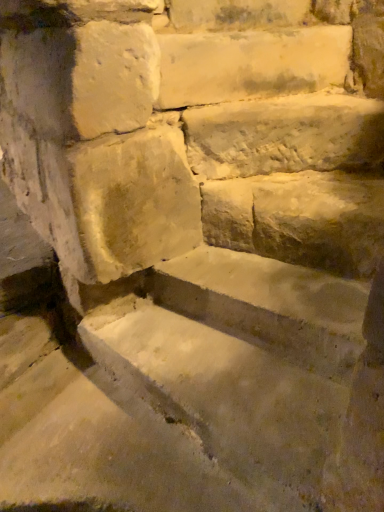
In order to face white stone step at upper center, which ranks as the first limestone in top-to-bottom order, should I rotate leftwards or rightwards?

To align with it, rotate right about 6.845°.

Describe the element at coordinates (237, 14) in the screenshot. I see `smooth stone brick at upper center` at that location.

Where is `white rough stone at center, which is the 2th limestone in top-to-bottom order`? white rough stone at center, which is the 2th limestone in top-to-bottom order is located at coordinates (285, 135).

Based on their sizes in the image, would you say white rough stone at center, acting as the 1th limestone starting from the bottom, is bigger or smaller than white stone step at upper center, the 2th limestone positioned from the bottom?

In the image, white rough stone at center, acting as the 1th limestone starting from the bottom, appears to be larger than white stone step at upper center, the 2th limestone positioned from the bottom.

Does white rough stone at center, which is the 2th limestone in top-to-bottom order, have a lesser height compared to white stone step at upper center, which ranks as the first limestone in top-to-bottom order?

Correct, white rough stone at center, which is the 2th limestone in top-to-bottom order, is not as tall as white stone step at upper center, which ranks as the first limestone in top-to-bottom order.

Is there a large distance between white rough stone at center, acting as the 1th limestone starting from the bottom, and white stone step at upper center, which ranks as the first limestone in top-to-bottom order?

No, there isn't a large distance between white rough stone at center, acting as the 1th limestone starting from the bottom, and white stone step at upper center, which ranks as the first limestone in top-to-bottom order.

Is white rough stone at center, acting as the 1th limestone starting from the bottom, to the right of white stone step at upper center, the 2th limestone positioned from the bottom, from the viewer's perspective?

Indeed, white rough stone at center, acting as the 1th limestone starting from the bottom, is positioned on the right side of white stone step at upper center, the 2th limestone positioned from the bottom.

Is smooth stone brick at upper center oriented towards white stone step at upper center, which ranks as the first limestone in top-to-bottom order?

No.

Is white stone step at upper center, the 2th limestone positioned from the bottom, located within smooth stone brick at upper center?

No, white stone step at upper center, the 2th limestone positioned from the bottom, is located outside of smooth stone brick at upper center.

Based on the photo, who is more distant, smooth stone brick at upper center or white stone step at upper center, the 2th limestone positioned from the bottom?

smooth stone brick at upper center is behind.

I want to click on brick behind the white stone step at upper center, which ranks as the first limestone in top-to-bottom order, so click(x=237, y=14).

Is white stone step at upper center, which ranks as the first limestone in top-to-bottom order, with smooth stone brick at upper center?

white stone step at upper center, which ranks as the first limestone in top-to-bottom order, and smooth stone brick at upper center are clearly separated.

The height and width of the screenshot is (512, 384). What are the coordinates of `brick located above the white stone step at upper center, the 2th limestone positioned from the bottom (from a real-world perspective)` in the screenshot? It's located at (237, 14).

Is smooth stone brick at upper center at the back of white stone step at upper center, the 2th limestone positioned from the bottom?

white stone step at upper center, the 2th limestone positioned from the bottom, is not turned away from smooth stone brick at upper center.

Where is `brick on the left side of white rough stone at center, which is the 2th limestone in top-to-bottom order`? brick on the left side of white rough stone at center, which is the 2th limestone in top-to-bottom order is located at coordinates (237, 14).

Based on the photo, how distant is white rough stone at center, acting as the 1th limestone starting from the bottom, from smooth stone brick at upper center?

white rough stone at center, acting as the 1th limestone starting from the bottom, is 16.09 inches from smooth stone brick at upper center.

In terms of width, does white rough stone at center, acting as the 1th limestone starting from the bottom, look wider or thinner when compared to smooth stone brick at upper center?

Considering their sizes, white rough stone at center, acting as the 1th limestone starting from the bottom, looks broader than smooth stone brick at upper center.

Is white rough stone at center, acting as the 1th limestone starting from the bottom, taller or shorter than smooth stone brick at upper center?

Clearly, white rough stone at center, acting as the 1th limestone starting from the bottom, is taller compared to smooth stone brick at upper center.

Is smooth stone brick at upper center in contact with white rough stone at center, which is the 2th limestone in top-to-bottom order?

smooth stone brick at upper center and white rough stone at center, which is the 2th limestone in top-to-bottom order, are not in contact.

This screenshot has height=512, width=384. I want to click on brick lying behind the white rough stone at center, acting as the 1th limestone starting from the bottom, so [237, 14].

Can you confirm if smooth stone brick at upper center is positioned to the right of white rough stone at center, which is the 2th limestone in top-to-bottom order?

No.

Does smooth stone brick at upper center have a greater height compared to white rough stone at center, acting as the 1th limestone starting from the bottom?

In fact, smooth stone brick at upper center may be shorter than white rough stone at center, acting as the 1th limestone starting from the bottom.

Based on the photo, is white stone step at upper center, the 2th limestone positioned from the bottom, surrounding white rough stone at center, acting as the 1th limestone starting from the bottom?

No.

Which object is positioned more to the left, white stone step at upper center, the 2th limestone positioned from the bottom, or white rough stone at center, which is the 2th limestone in top-to-bottom order?

Positioned to the left is white stone step at upper center, the 2th limestone positioned from the bottom.

From a real-world perspective, who is located higher, white stone step at upper center, the 2th limestone positioned from the bottom, or white rough stone at center, acting as the 1th limestone starting from the bottom?

In real-world perspective, white stone step at upper center, the 2th limestone positioned from the bottom, is above.

I want to click on limestone located below the white stone step at upper center, which ranks as the first limestone in top-to-bottom order (from the image's perspective), so click(285, 135).

Where is `limestone that is the 1st object to the right of the smooth stone brick at upper center, starting at the anchor`? This screenshot has width=384, height=512. limestone that is the 1st object to the right of the smooth stone brick at upper center, starting at the anchor is located at coordinates (250, 64).

Estimate the real-world distances between objects in this image. Which object is closer to white rough stone at center, acting as the 1th limestone starting from the bottom, smooth stone brick at upper center or white stone step at upper center, the 2th limestone positioned from the bottom?

white stone step at upper center, the 2th limestone positioned from the bottom, is positioned closer to the anchor white rough stone at center, acting as the 1th limestone starting from the bottom.

Estimate the real-world distances between objects in this image. Which object is further from white rough stone at center, which is the 2th limestone in top-to-bottom order, white stone step at upper center, the 2th limestone positioned from the bottom, or smooth stone brick at upper center?

Among the two, smooth stone brick at upper center is located further to white rough stone at center, which is the 2th limestone in top-to-bottom order.

Which object lies nearer to the anchor point white stone step at upper center, which ranks as the first limestone in top-to-bottom order, white rough stone at center, which is the 2th limestone in top-to-bottom order, or smooth stone brick at upper center?

smooth stone brick at upper center is positioned closer to the anchor white stone step at upper center, which ranks as the first limestone in top-to-bottom order.

Which object lies further to the anchor point smooth stone brick at upper center, white stone step at upper center, which ranks as the first limestone in top-to-bottom order, or white rough stone at center, which is the 2th limestone in top-to-bottom order?

white rough stone at center, which is the 2th limestone in top-to-bottom order, is further to smooth stone brick at upper center.

Based on their spatial positions, is smooth stone brick at upper center or white rough stone at center, acting as the 1th limestone starting from the bottom, closer to white stone step at upper center, which ranks as the first limestone in top-to-bottom order?

smooth stone brick at upper center lies closer to white stone step at upper center, which ranks as the first limestone in top-to-bottom order, than the other object.

Estimate the real-world distances between objects in this image. Which object is further from smooth stone brick at upper center, white rough stone at center, acting as the 1th limestone starting from the bottom, or white stone step at upper center, which ranks as the first limestone in top-to-bottom order?

white rough stone at center, acting as the 1th limestone starting from the bottom, lies further to smooth stone brick at upper center than the other object.

I want to click on limestone between smooth stone brick at upper center and white rough stone at center, which is the 2th limestone in top-to-bottom order, vertically, so click(250, 64).